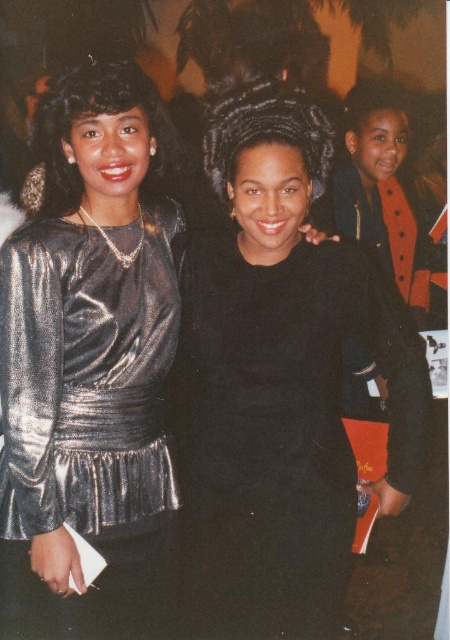
Question: In this image, where is black matte dress at center located relative to shiny metallic dress at left?

Choices:
 (A) right
 (B) left

Answer: (A)

Question: Can you confirm if black matte dress at center is smaller than shiny metallic dress at left?

Choices:
 (A) yes
 (B) no

Answer: (B)

Question: Is black matte dress at center bigger than metallic silver dress at center?

Choices:
 (A) no
 (B) yes

Answer: (A)

Question: Considering the real-world distances, which object is closest to the shiny metallic dress at left?

Choices:
 (A) metallic silver dress at center
 (B) black matte dress at center

Answer: (A)

Question: Which point is closer to the camera taking this photo?

Choices:
 (A) (188, 314)
 (B) (46, 465)
 (C) (138, 624)

Answer: (B)

Question: Which of the following is the farthest from the observer?

Choices:
 (A) shiny metallic dress at left
 (B) metallic silver dress at center

Answer: (A)